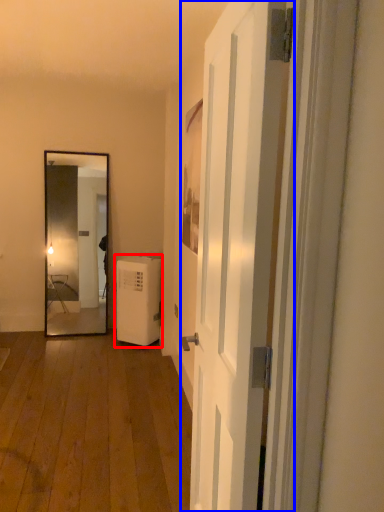
Question: Which of the following is the farthest to the observer, water heater (highlighted by a red box) or door (highlighted by a blue box)?

Choices:
 (A) water heater
 (B) door

Answer: (A)